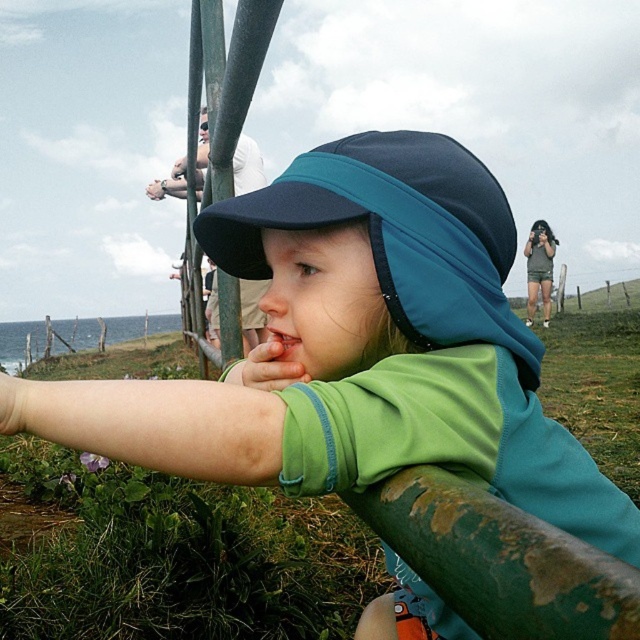
Question: Which point is closer to the camera taking this photo?

Choices:
 (A) (280, 198)
 (B) (547, 228)

Answer: (A)

Question: Can you confirm if rusty metal pole at upper center is smaller than pink glossy lips at center?

Choices:
 (A) no
 (B) yes

Answer: (A)

Question: Considering the relative positions of navy blue fabric sun visor at center and matte blue hat at upper center in the image provided, where is navy blue fabric sun visor at center located with respect to matte blue hat at upper center?

Choices:
 (A) above
 (B) below

Answer: (B)

Question: Can you confirm if rusty metal pole at upper center is bigger than pink glossy lips at center?

Choices:
 (A) no
 (B) yes

Answer: (B)

Question: Considering the real-world distances, which object is closest to the navy blue fabric sun visor at center?

Choices:
 (A) pink glossy lips at center
 (B) rusty metal pole at upper center

Answer: (A)

Question: Which object appears closest to the camera in this image?

Choices:
 (A) navy blue fabric sun visor at center
 (B) pink glossy lips at center

Answer: (A)